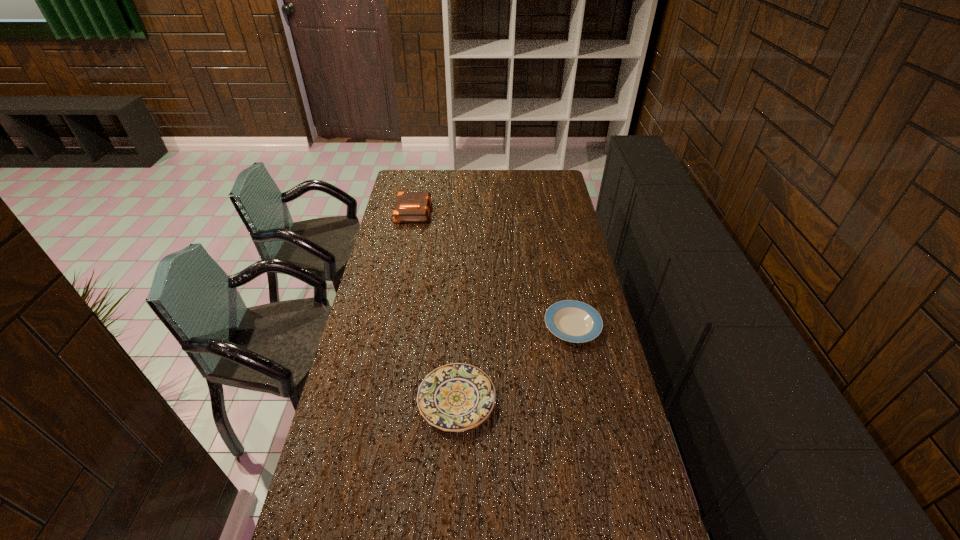
Identify the location of the tallest object. The height and width of the screenshot is (540, 960). (x=410, y=206).

Where is `Bible`? This screenshot has width=960, height=540. Bible is located at coordinates (410, 206).

Where is `the nearer plate`? Image resolution: width=960 pixels, height=540 pixels. the nearer plate is located at coordinates (456, 397).

Locate an element on the screen. This screenshot has height=540, width=960. the second object from left to right is located at coordinates (456, 397).

Locate an element on the screen. the farther plate is located at coordinates (570, 320).

This screenshot has height=540, width=960. Find the location of `the rightmost object`. the rightmost object is located at coordinates (570, 320).

Find the location of a particular element. The height and width of the screenshot is (540, 960). vacant region located on the spine side of the Bible is located at coordinates (511, 211).

The image size is (960, 540). Identify the location of vacant space located on the right of the nearest object. (546, 400).

Where is `vacant space situated 0.190m on the left of the right plate`? vacant space situated 0.190m on the left of the right plate is located at coordinates (492, 325).

Locate an element on the screen. object at the left edge is located at coordinates pyautogui.click(x=410, y=206).